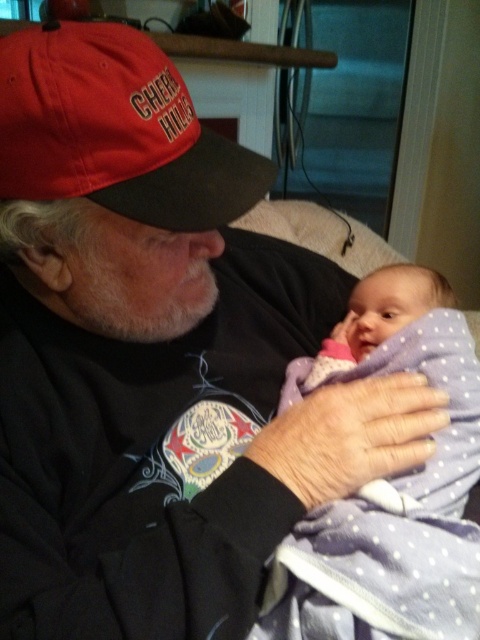
Is purple polka dot blanket at center thinner than red matte baseball cap at upper left?

No.

Between purple polka dot blanket at center and red matte baseball cap at upper left, which one appears on the left side from the viewer's perspective?

red matte baseball cap at upper left is more to the left.

Between point (373, 323) and point (169, 179), which one is positioned behind?

Positioned behind is point (373, 323).

You are a GUI agent. You are given a task and a screenshot of the screen. Output one action in this format:
    pyautogui.click(x=<x>, y=<y>)
    Task: Click on the purple polka dot blanket at center
    Image resolution: width=480 pixels, height=640 pixels.
    Given the screenshot: What is the action you would take?
    pyautogui.click(x=388, y=484)